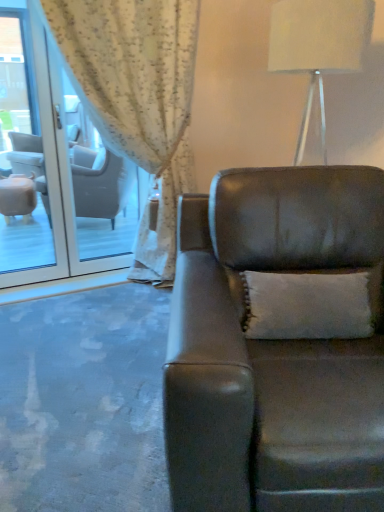
Question: Does point (306, 315) appear closer or farther from the camera than point (369, 4)?

Choices:
 (A) farther
 (B) closer

Answer: (B)

Question: In terms of width, does white textured pillow at center look wider or thinner when compared to white fabric lampshade at upper right?

Choices:
 (A) wide
 (B) thin

Answer: (B)

Question: Estimate the real-world distances between objects in this image. Which object is closer to the white textured curtain at upper left?

Choices:
 (A) clear glass door at left
 (B) white textured pillow at center
 (C) white fabric lampshade at upper right
 (D) leather couch at center

Answer: (A)

Question: Estimate the real-world distances between objects in this image. Which object is farther from the white textured curtain at upper left?

Choices:
 (A) white fabric lampshade at upper right
 (B) leather couch at center
 (C) white textured pillow at center
 (D) clear glass door at left

Answer: (C)